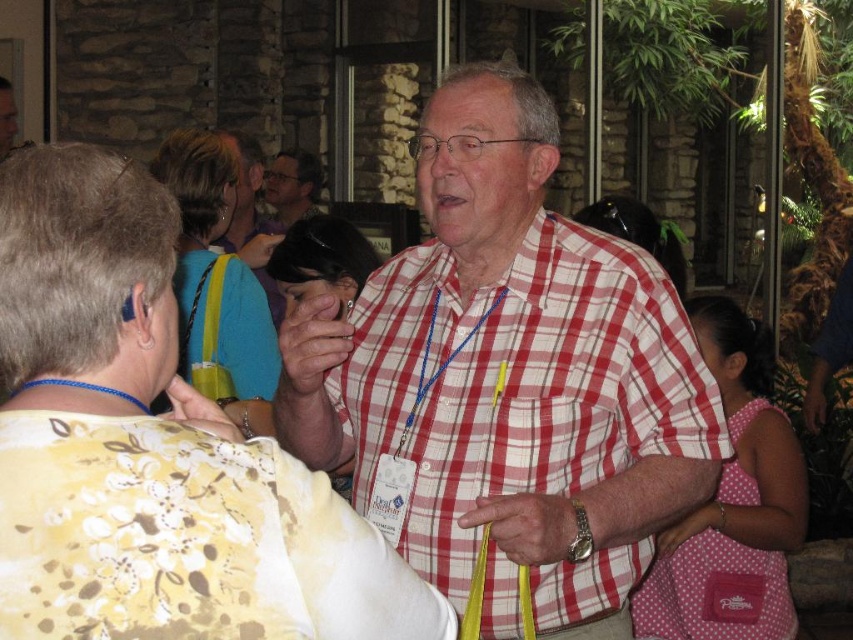
You are a photographer at the event and need to capture a closeup of the man in the red and white checkered shirt. Which object, the matte yellow lanyard at upper center or the matte black glasses at upper center, would be more prominent in the photo due to its size?

The matte yellow lanyard at upper center is larger in size than the matte black glasses at upper center, so it would be more prominent in the closeup photo.

You are a photographer at the event and want to capture a closeup of the man in the red and white checkered shirt. You need to ensure that both the matte yellow lanyard at upper center and the matte black glasses at upper center are visible in the frame. Based on their positions, which object should be positioned to the right side of your camera frame?

The matte yellow lanyard at upper center should be positioned to the right side of your camera frame because it is located to the right of the matte black glasses at upper center.